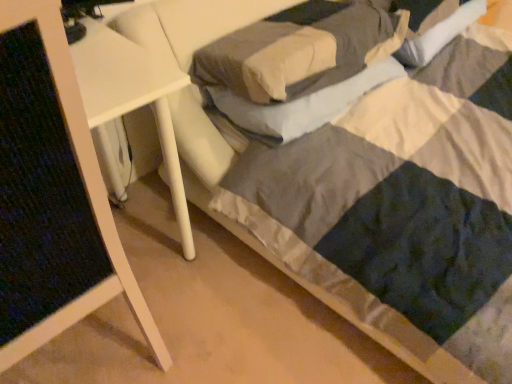
Locate an element on the screen. spots to the right of white glossy side table at upper left is located at coordinates (239, 308).